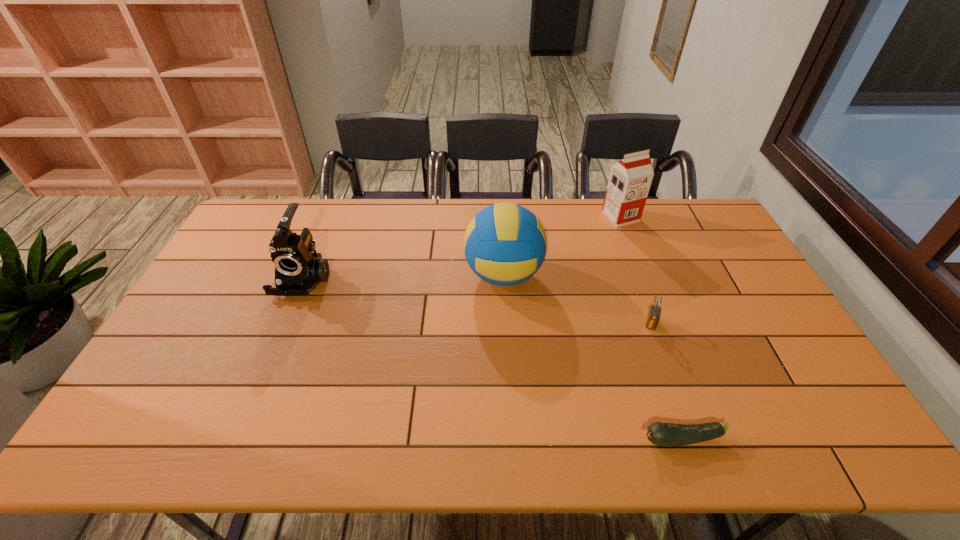
This screenshot has height=540, width=960. In order to click on soya milk in this screenshot , I will do `click(630, 179)`.

You are a GUI agent. You are given a task and a screenshot of the screen. Output one action in this format:
    pyautogui.click(x=<x>, y=<y>)
    Task: Click on the fourth object from right to left
    
    Given the screenshot: What is the action you would take?
    pyautogui.click(x=505, y=244)

The image size is (960, 540). In order to click on camcorder in this screenshot , I will do `click(298, 270)`.

Locate an element on the screen. the second nearest object is located at coordinates (653, 317).

Where is `padlock`? The width and height of the screenshot is (960, 540). padlock is located at coordinates (653, 317).

This screenshot has width=960, height=540. Find the location of `zucchini`. zucchini is located at coordinates (665, 434).

Where is `the nearest object`? The image size is (960, 540). the nearest object is located at coordinates (665, 434).

Where is `vacant point located on the right of the farthest object`? The image size is (960, 540). vacant point located on the right of the farthest object is located at coordinates (700, 217).

This screenshot has width=960, height=540. I want to click on free location located on the back of the volleyball, so click(500, 219).

Where is `free location located on the lens mount of the leftmost object`? The height and width of the screenshot is (540, 960). free location located on the lens mount of the leftmost object is located at coordinates (287, 318).